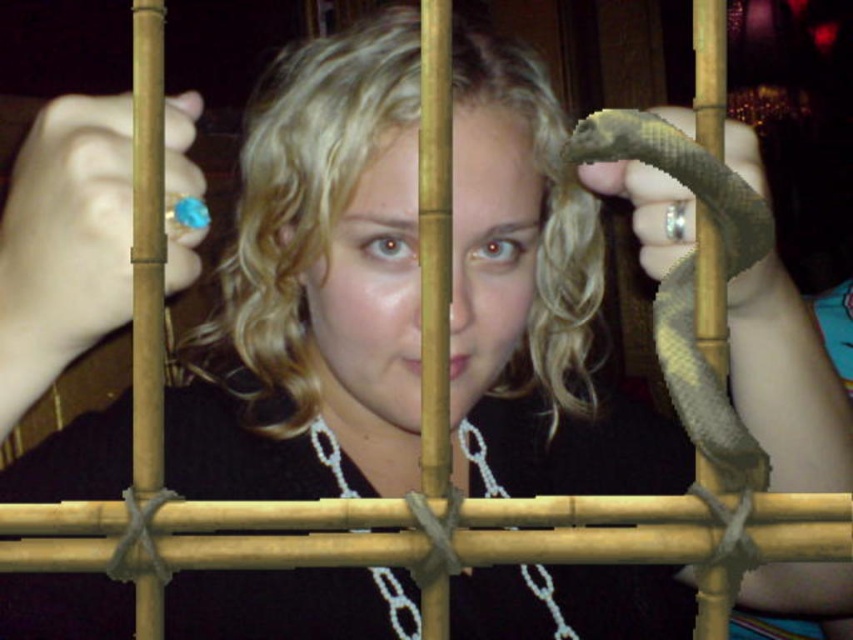
Between green matte snake at center and silver metallic chain at center, which one has less height?

With less height is silver metallic chain at center.

Between point (706, 454) and point (407, 609), which one is positioned in front?

Point (706, 454)

Who is more distant from viewer, (611, 141) or (457, 429)?

The point (457, 429) is behind.

You are a GUI agent. You are given a task and a screenshot of the screen. Output one action in this format:
    pyautogui.click(x=<x>, y=<y>)
    Task: Click on the green matte snake at center
    
    Given the screenshot: What is the action you would take?
    pyautogui.click(x=706, y=412)